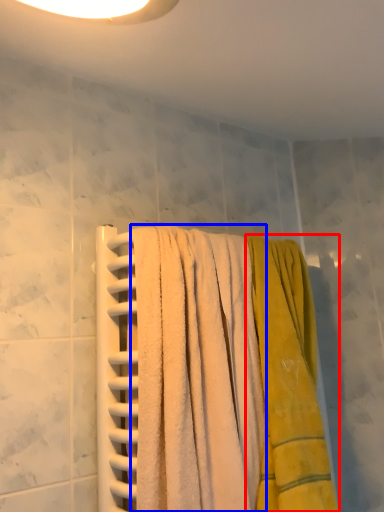
Question: Among these objects, which one is nearest to the camera, towel (highlighted by a red box) or towel (highlighted by a blue box)?

Choices:
 (A) towel
 (B) towel

Answer: (B)